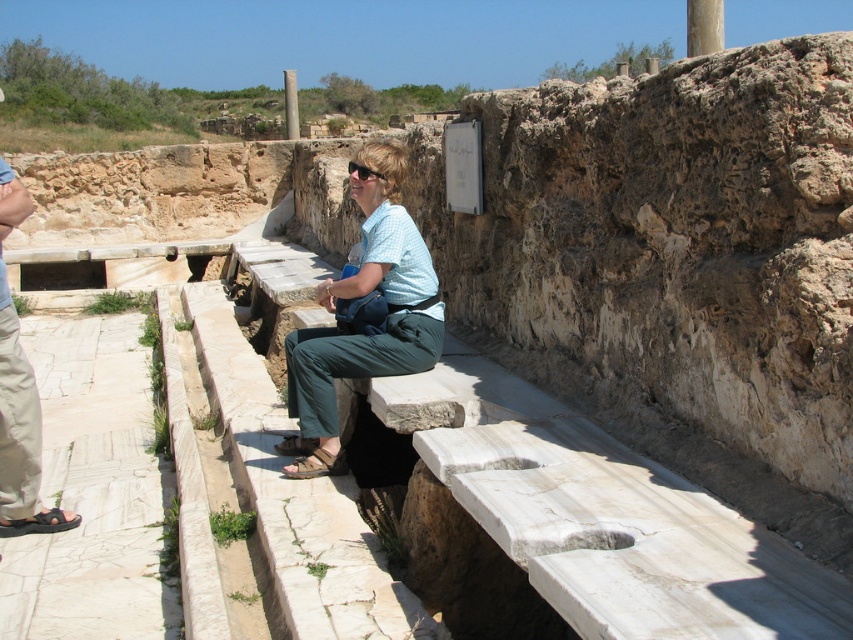
Question: Which object is closer to the camera taking this photo?

Choices:
 (A) green fabric pants at center
 (B) beige cotton pants at lower left

Answer: (B)

Question: Is green fabric pants at center thinner than beige cotton pants at lower left?

Choices:
 (A) no
 (B) yes

Answer: (A)

Question: Among these points, which one is farthest from the camera?

Choices:
 (A) (302, 422)
 (B) (16, 529)

Answer: (A)

Question: Which point is farther from the camera taking this photo?

Choices:
 (A) 314,419
 (B) 10,225

Answer: (A)

Question: Is green fabric pants at center wider than beige cotton pants at lower left?

Choices:
 (A) no
 (B) yes

Answer: (B)

Question: Is green fabric pants at center in front of beige cotton pants at lower left?

Choices:
 (A) no
 (B) yes

Answer: (A)